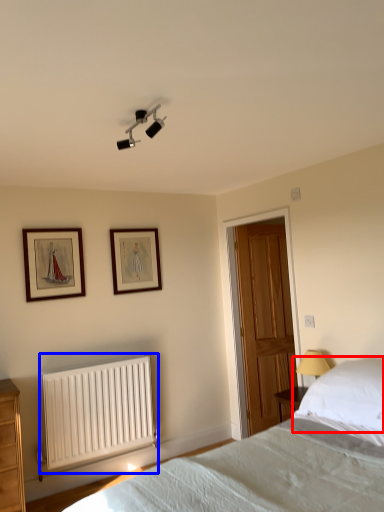
Question: Which point is closer to the camera, pillow (highlighted by a red box) or radiator (highlighted by a blue box)?

Choices:
 (A) pillow
 (B) radiator

Answer: (A)